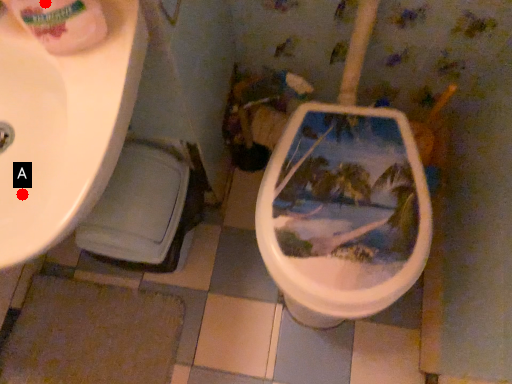
Question: Two points are circled on the image, labeled by A and B beside each circle. Which point is closer to the camera taking this photo?

Choices:
 (A) A is closer
 (B) B is closer

Answer: (B)